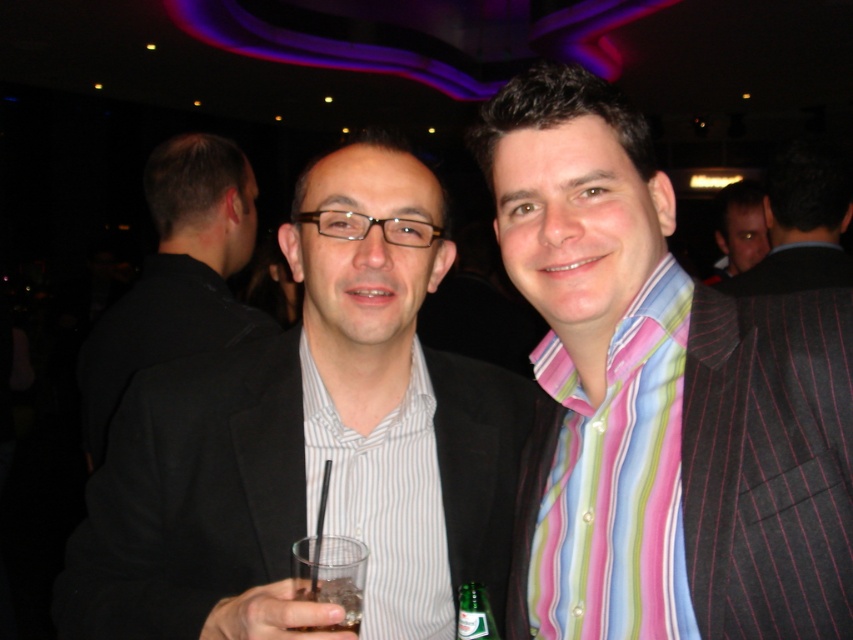
Is dark pinstripe suit at right to the right of clear glass at center from the viewer's perspective?

Yes, dark pinstripe suit at right is to the right of clear glass at center.

Can you confirm if dark pinstripe suit at right is positioned below clear glass at center?

No, dark pinstripe suit at right is not below clear glass at center.

Between point (785, 172) and point (352, 568), which one is positioned behind?

Positioned behind is point (785, 172).

Locate an element on the screen. dark pinstripe suit at right is located at coordinates (802, 224).

Which is in front, point (830, 186) or point (751, 218)?

Point (830, 186) is in front.

Between point (787, 211) and point (734, 268), which one is positioned behind?

Point (734, 268)

The width and height of the screenshot is (853, 640). I want to click on dark pinstripe suit at right, so click(802, 224).

This screenshot has width=853, height=640. What do you see at coordinates (660, 400) in the screenshot? I see `striped cotton shirt at center` at bounding box center [660, 400].

In the scene shown: Can you confirm if striped cotton shirt at center is bigger than black smooth suit at left?

No, striped cotton shirt at center is not bigger than black smooth suit at left.

Between point (839, 499) and point (137, 310), which one is positioned behind?

The point (137, 310) is more distant.

The height and width of the screenshot is (640, 853). What are the coordinates of `striped cotton shirt at center` in the screenshot? It's located at [x=660, y=400].